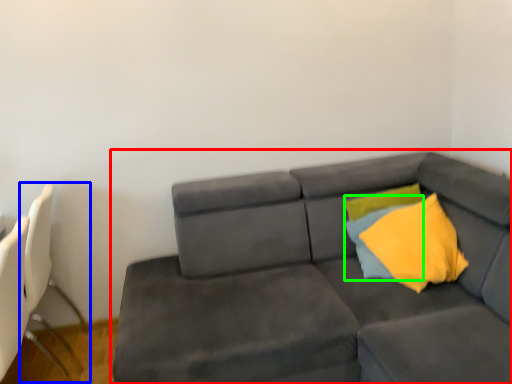
Question: Considering the real-world distances, which object is farthest from studio couch (highlighted by a red box)? swivel chair (highlighted by a blue box) or pillow (highlighted by a green box)?

Choices:
 (A) swivel chair
 (B) pillow

Answer: (A)